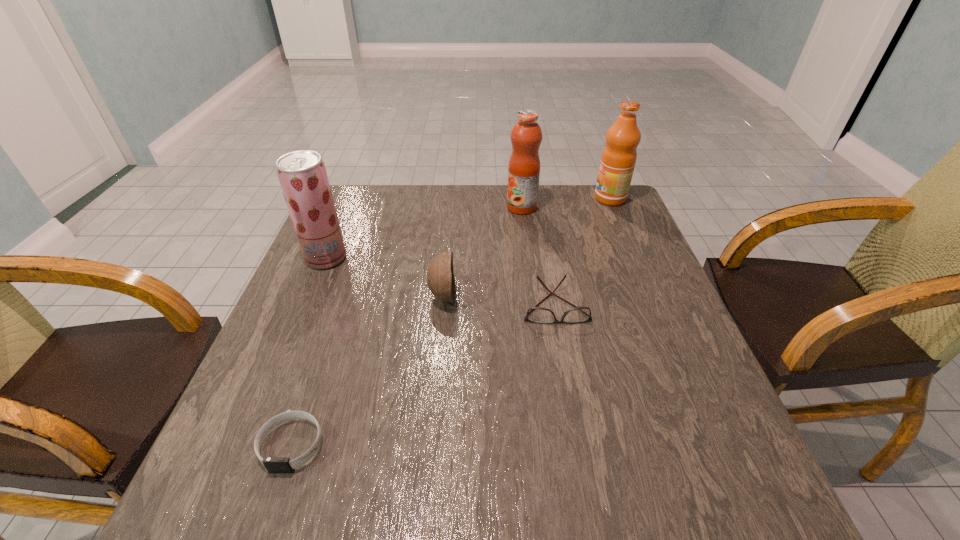
Find the location of a particular element. free space located on the label side of the rightmost object is located at coordinates (512, 199).

Locate an element on the screen. Image resolution: width=960 pixels, height=540 pixels. blank area located 0.080m on the front label of the second fruit juice from right to left is located at coordinates [480, 207].

Identify the location of vacant region located on the front label of the second fruit juice from right to left. (393, 207).

The image size is (960, 540). I want to click on vacant region located 0.090m on the front label of the second fruit juice from right to left, so click(477, 207).

I want to click on vacant space located 0.230m on the right of the leftmost fruit juice, so click(433, 258).

Find the location of a particular element. blank area located on the back of the bowl is located at coordinates (451, 204).

Identify the location of vacant area situated 0.220m on the front-facing side of the spectacles. coord(574,413).

Where is `free region located on the outer surface of the nearest object`? The height and width of the screenshot is (540, 960). free region located on the outer surface of the nearest object is located at coordinates (264, 525).

Identify the location of object positioned at the near edge. Image resolution: width=960 pixels, height=540 pixels. (273, 464).

Identify the location of fruit juice at the left edge. This screenshot has height=540, width=960. (302, 174).